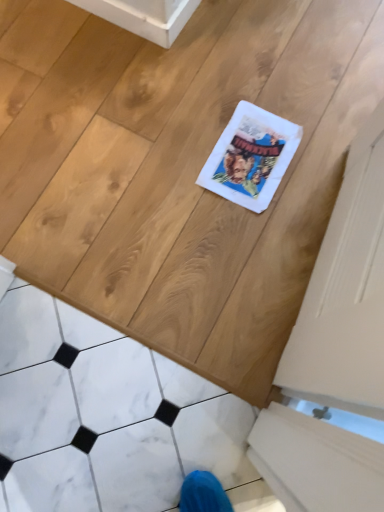
Describe the element at coordinates (108, 418) in the screenshot. Image resolution: width=384 pixels, height=512 pixels. I see `white marble tile at lower left` at that location.

The width and height of the screenshot is (384, 512). What are the coordinates of `white marble tile at lower left` in the screenshot? It's located at (108, 418).

Locate an element on the screen. white matte screen door at right is located at coordinates (345, 295).

Describe the element at coordinates (345, 295) in the screenshot. I see `white matte screen door at right` at that location.

This screenshot has height=512, width=384. Find the location of `white marble tile at lower left`. white marble tile at lower left is located at coordinates (108, 418).

Between white marble tile at lower left and white matte screen door at right, which one appears on the left side from the viewer's perspective?

From the viewer's perspective, white marble tile at lower left appears more on the left side.

Relative to white matte screen door at right, is white marble tile at lower left in front or behind?

white marble tile at lower left is in front of white matte screen door at right.

Does point (14, 362) appear closer or farther from the camera than point (334, 261)?

Point (14, 362).

From the image's perspective, is white marble tile at lower left below white matte screen door at right?

Correct, white marble tile at lower left appears lower than white matte screen door at right in the image.

From a real-world perspective, is white marble tile at lower left under white matte screen door at right?

Actually, white marble tile at lower left is physically above white matte screen door at right in the real world.

Is white marble tile at lower left wider than white matte screen door at right?

Correct, the width of white marble tile at lower left exceeds that of white matte screen door at right.

Who is taller, white marble tile at lower left or white matte screen door at right?

Standing taller between the two is white marble tile at lower left.

Considering the relative sizes of white marble tile at lower left and white matte screen door at right in the image provided, is white marble tile at lower left bigger than white matte screen door at right?

Yes, white marble tile at lower left is bigger than white matte screen door at right.

Is white marble tile at lower left inside or outside of white matte screen door at right?

white marble tile at lower left exists outside the volume of white matte screen door at right.

Is the surface of white marble tile at lower left in direct contact with white matte screen door at right?

No, white marble tile at lower left is not beside white matte screen door at right.

Is white marble tile at lower left facing towards white matte screen door at right?

No, white marble tile at lower left is not aimed at white matte screen door at right.

Where is `marble above the white matte screen door at right (from a real-world perspective)`? marble above the white matte screen door at right (from a real-world perspective) is located at coordinates (108, 418).

Which object is positioned more to the left, white matte screen door at right or white marble tile at lower left?

white marble tile at lower left.

Is white matte screen door at right positioned before white marble tile at lower left?

No, it is behind white marble tile at lower left.

Considering the positions of point (334, 309) and point (33, 372), is point (334, 309) closer or farther from the camera than point (33, 372)?

Point (334, 309).

From the image's perspective, which one is positioned lower, white matte screen door at right or white marble tile at lower left?

white marble tile at lower left is shown below in the image.

Based on the photo, from a real-world perspective, is white matte screen door at right under white marble tile at lower left?

Yes, from a real-world perspective, white matte screen door at right is beneath white marble tile at lower left.

Which of these two, white matte screen door at right or white marble tile at lower left, is thinner?

white matte screen door at right.

In terms of height, does white matte screen door at right look taller or shorter compared to white marble tile at lower left?

Clearly, white matte screen door at right is shorter compared to white marble tile at lower left.

Can you confirm if white matte screen door at right is bigger than white marble tile at lower left?

Actually, white matte screen door at right might be smaller than white marble tile at lower left.

Is white marble tile at lower left located within white matte screen door at right?

No, white marble tile at lower left is located outside of white matte screen door at right.

Is white matte screen door at right far away from white marble tile at lower left?

white matte screen door at right is actually quite close to white marble tile at lower left.

Is white matte screen door at right positioned with its back to white marble tile at lower left?

white matte screen door at right is not turned away from white marble tile at lower left.

How many degrees apart are the facing directions of white matte screen door at right and white marble tile at lower left?

The angular difference between white matte screen door at right and white marble tile at lower left is 82.9 degrees.

Measure the distance from white matte screen door at right to white marble tile at lower left.

white matte screen door at right and white marble tile at lower left are 41.50 centimeters apart from each other.

Where is `screen door that is under the white marble tile at lower left (from a real-world perspective)`? This screenshot has height=512, width=384. screen door that is under the white marble tile at lower left (from a real-world perspective) is located at coordinates (345, 295).

Locate an element on the screen. The image size is (384, 512). screen door above the white marble tile at lower left (from the image's perspective) is located at coordinates pos(345,295).

The width and height of the screenshot is (384, 512). I want to click on screen door behind the white marble tile at lower left, so 345,295.